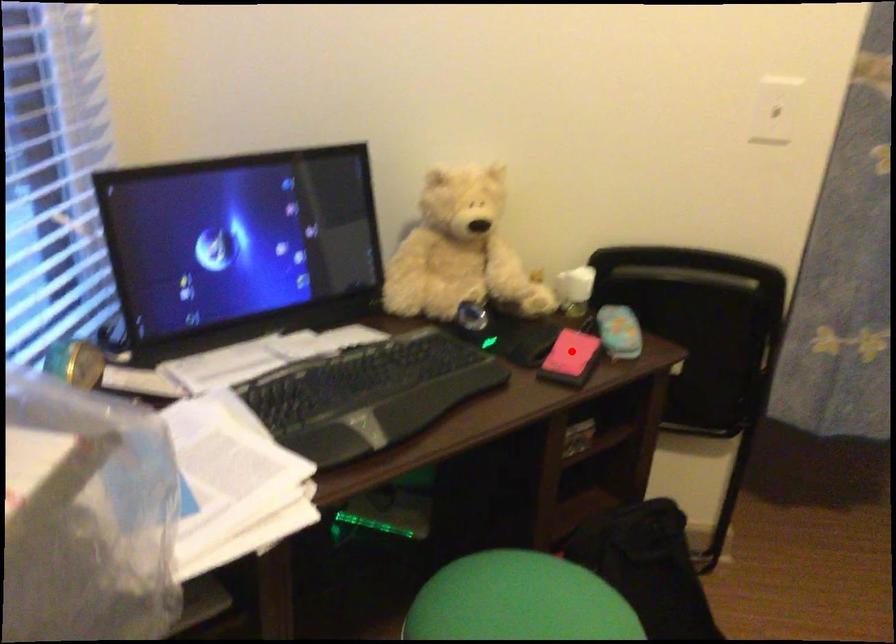
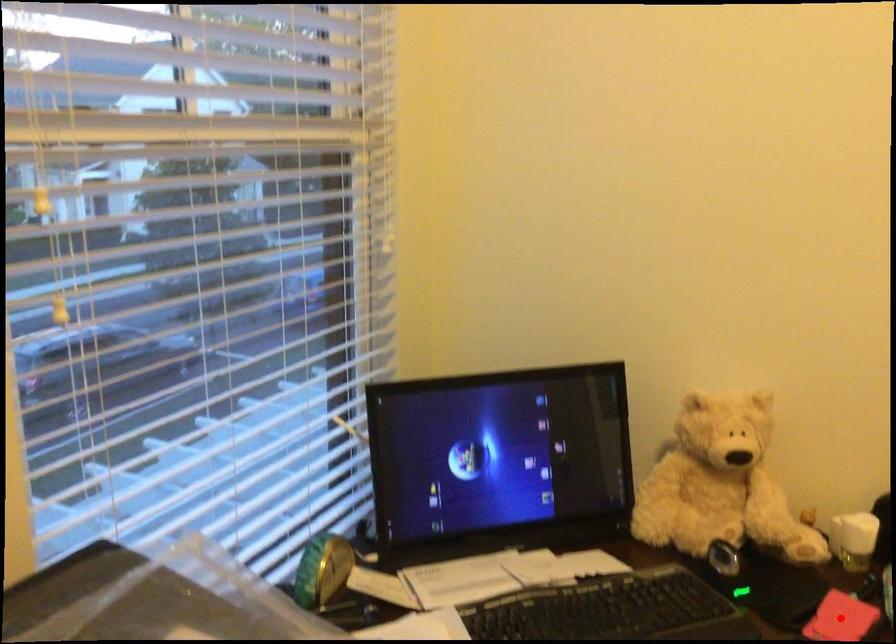
I am providing you with two images of the same scene from different viewpoints. A red point is marked on the first image and another point is marked on the second image. Is the red point in image1 aligned with the point shown in image2?

Yes